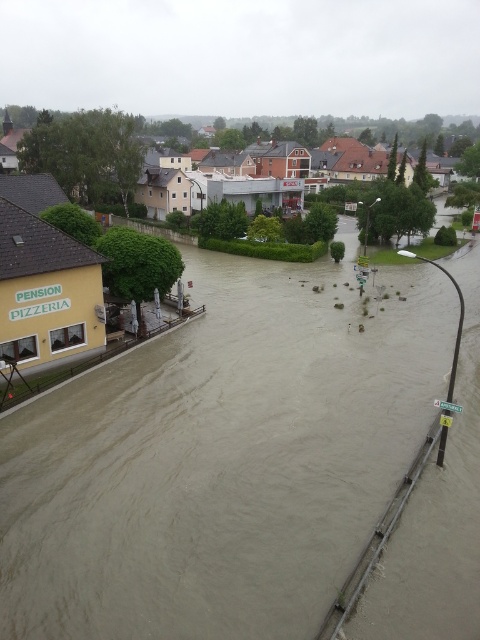
Can you confirm if brown muddy water at lower center is wider than brown wooden houses at center?

In fact, brown muddy water at lower center might be narrower than brown wooden houses at center.

Which is in front, point (79, 589) or point (259, 156)?

Point (79, 589) is in front.

This screenshot has width=480, height=640. In order to click on brown muddy water at lower center in this screenshot , I will do `click(223, 458)`.

Can you confirm if brown muddy water at lower center is positioned to the right of yellow building at left?

Correct, you'll find brown muddy water at lower center to the right of yellow building at left.

Is brown muddy water at lower center positioned at the back of yellow building at left?

No, brown muddy water at lower center is in front of yellow building at left.

Describe the element at coordinates (223, 458) in the screenshot. Image resolution: width=480 pixels, height=640 pixels. I see `brown muddy water at lower center` at that location.

Locate an element on the screen. The image size is (480, 640). brown muddy water at lower center is located at coordinates (223, 458).

Between yellow building at left and brown wooden houses at center, which one is positioned higher?

brown wooden houses at center is higher up.

Locate an element on the screen. The width and height of the screenshot is (480, 640). yellow building at left is located at coordinates (182, 173).